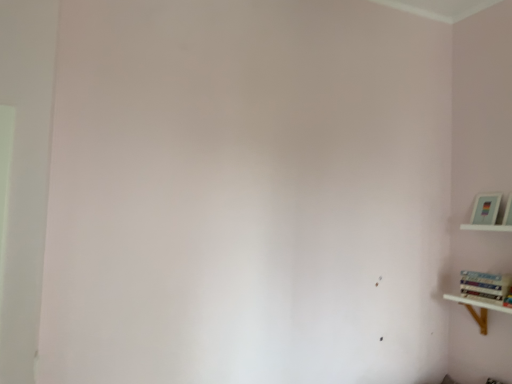
What is the approximate width of white wooden shelf at lower right, the 1th shelf in the bottom-to-top sequence?

The width of white wooden shelf at lower right, the 1th shelf in the bottom-to-top sequence, is 8.63 inches.

Where is `white wooden shelf at upper right, the first shelf from the top`? white wooden shelf at upper right, the first shelf from the top is located at coordinates (488, 214).

Where is `hardcover book at right`? hardcover book at right is located at coordinates (485, 286).

How much distance is there between white wooden shelf at upper right, the first shelf from the top, and hardcover book at right?

white wooden shelf at upper right, the first shelf from the top, and hardcover book at right are 13.17 inches apart.

From the image's perspective, is white wooden shelf at upper right, the first shelf from the top, located above or below hardcover book at right?

Based on their image positions, white wooden shelf at upper right, the first shelf from the top, is located above hardcover book at right.

Considering the sizes of white wooden shelf at upper right, the 2th shelf when ordered from bottom to top, and hardcover book at right in the image, is white wooden shelf at upper right, the 2th shelf when ordered from bottom to top, wider or thinner than hardcover book at right?

Clearly, white wooden shelf at upper right, the 2th shelf when ordered from bottom to top, has less width compared to hardcover book at right.

In the image, is white wooden shelf at upper right, the 2th shelf when ordered from bottom to top, positioned in front of or behind hardcover book at right?

In the image, white wooden shelf at upper right, the 2th shelf when ordered from bottom to top, appears behind hardcover book at right.

Looking at the image, does hardcover book at right seem bigger or smaller compared to white wooden shelf at lower right, the 1th shelf in the bottom-to-top sequence?

Considering their sizes, hardcover book at right takes up less space than white wooden shelf at lower right, the 1th shelf in the bottom-to-top sequence.

Is hardcover book at right facing away from white wooden shelf at lower right, which is the 2th shelf from top to bottom?

hardcover book at right is not turned away from white wooden shelf at lower right, which is the 2th shelf from top to bottom.

Identify the location of book located above the white wooden shelf at lower right, the 1th shelf in the bottom-to-top sequence (from a real-world perspective). Image resolution: width=512 pixels, height=384 pixels. (485, 286).

Does point (490, 294) appear closer or farther from the camera than point (464, 303)?

Clearly, point (490, 294) is closer to the camera than point (464, 303).

Is point (465, 297) closer or farther from the camera than point (484, 292)?

Clearly, point (465, 297) is more distant from the camera than point (484, 292).

Is white wooden shelf at lower right, which is the 2th shelf from top to bottom, bigger than hardcover book at right?

Yes, white wooden shelf at lower right, which is the 2th shelf from top to bottom, is bigger than hardcover book at right.

From the picture: Is white wooden shelf at lower right, which is the 2th shelf from top to bottom, positioned behind hardcover book at right?

No, it is not.

From a real-world perspective, between white wooden shelf at upper right, the 2th shelf when ordered from bottom to top, and white wooden shelf at lower right, which is the 2th shelf from top to bottom, who is vertically lower?

From a 3D spatial view, white wooden shelf at lower right, which is the 2th shelf from top to bottom, is below.

Which object is positioned more to the right, white wooden shelf at upper right, the 2th shelf when ordered from bottom to top, or white wooden shelf at lower right, which is the 2th shelf from top to bottom?

white wooden shelf at upper right, the 2th shelf when ordered from bottom to top, is more to the right.

Could you tell me if white wooden shelf at upper right, the 2th shelf when ordered from bottom to top, is facing white wooden shelf at lower right, the 1th shelf in the bottom-to-top sequence?

No, white wooden shelf at upper right, the 2th shelf when ordered from bottom to top, is not aimed at white wooden shelf at lower right, the 1th shelf in the bottom-to-top sequence.

Looking at this image, in terms of size, does white wooden shelf at upper right, the first shelf from the top, appear bigger or smaller than white wooden shelf at lower right, the 1th shelf in the bottom-to-top sequence?

Considering their sizes, white wooden shelf at upper right, the first shelf from the top, takes up less space than white wooden shelf at lower right, the 1th shelf in the bottom-to-top sequence.

Where is `shelf lying on the right of hardcover book at right`? shelf lying on the right of hardcover book at right is located at coordinates (488, 214).

Is point (510, 279) farther from viewer compared to point (472, 223)?

No, (510, 279) is in front of (472, 223).

Can you confirm if white wooden shelf at lower right, the 1th shelf in the bottom-to-top sequence, is taller than white wooden shelf at upper right, the first shelf from the top?

Yes.

Is white wooden shelf at lower right, which is the 2th shelf from top to bottom, inside or outside of white wooden shelf at upper right, the 2th shelf when ordered from bottom to top?

white wooden shelf at lower right, which is the 2th shelf from top to bottom, cannot be found inside white wooden shelf at upper right, the 2th shelf when ordered from bottom to top.

Does white wooden shelf at lower right, which is the 2th shelf from top to bottom, have a lesser width compared to white wooden shelf at upper right, the 2th shelf when ordered from bottom to top?

Incorrect, the width of white wooden shelf at lower right, which is the 2th shelf from top to bottom, is not less than that of white wooden shelf at upper right, the 2th shelf when ordered from bottom to top.

Is white wooden shelf at lower right, the 1th shelf in the bottom-to-top sequence, oriented towards white wooden shelf at upper right, the 2th shelf when ordered from bottom to top?

No, white wooden shelf at lower right, the 1th shelf in the bottom-to-top sequence, is not facing towards white wooden shelf at upper right, the 2th shelf when ordered from bottom to top.

Where is `book on the left side of white wooden shelf at upper right, the first shelf from the top`? book on the left side of white wooden shelf at upper right, the first shelf from the top is located at coordinates (485, 286).

Find the location of a particular element. book that appears on the right of white wooden shelf at lower right, which is the 2th shelf from top to bottom is located at coordinates (485, 286).

Estimate the real-world distances between objects in this image. Which object is further from hardcover book at right, white wooden shelf at lower right, the 1th shelf in the bottom-to-top sequence, or white wooden shelf at upper right, the first shelf from the top?

Among the two, white wooden shelf at upper right, the first shelf from the top, is located further to hardcover book at right.

Which object lies nearer to the anchor point white wooden shelf at upper right, the 2th shelf when ordered from bottom to top, white wooden shelf at lower right, which is the 2th shelf from top to bottom, or hardcover book at right?

hardcover book at right.

Looking at the image, which one is located further to white wooden shelf at upper right, the first shelf from the top, hardcover book at right or white wooden shelf at lower right, the 1th shelf in the bottom-to-top sequence?

white wooden shelf at lower right, the 1th shelf in the bottom-to-top sequence, is further to white wooden shelf at upper right, the first shelf from the top.

Looking at the image, which one is located closer to white wooden shelf at lower right, the 1th shelf in the bottom-to-top sequence, hardcover book at right or white wooden shelf at upper right, the 2th shelf when ordered from bottom to top?

The object closer to white wooden shelf at lower right, the 1th shelf in the bottom-to-top sequence, is hardcover book at right.

Based on their spatial positions, is white wooden shelf at upper right, the first shelf from the top, or hardcover book at right closer to white wooden shelf at lower right, the 1th shelf in the bottom-to-top sequence?

hardcover book at right is closer to white wooden shelf at lower right, the 1th shelf in the bottom-to-top sequence.

When comparing their distances from hardcover book at right, does white wooden shelf at upper right, the first shelf from the top, or white wooden shelf at lower right, the 1th shelf in the bottom-to-top sequence, seem closer?

white wooden shelf at lower right, the 1th shelf in the bottom-to-top sequence.

Identify the location of book between white wooden shelf at upper right, the first shelf from the top, and white wooden shelf at lower right, which is the 2th shelf from top to bottom, in the up-down direction. This screenshot has height=384, width=512. (485, 286).